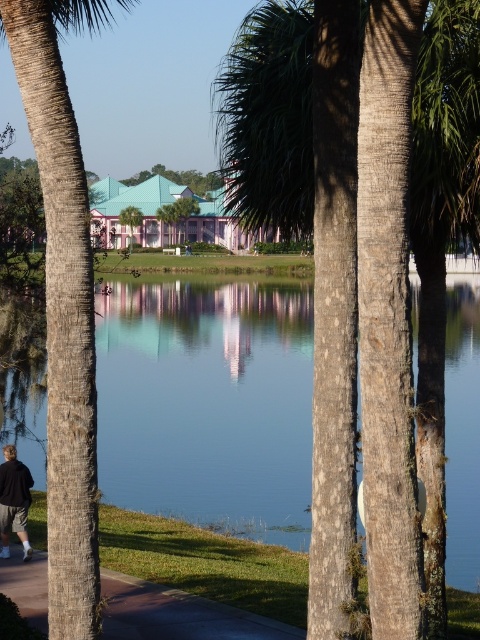
Question: Is blue glass water at center above black fabric person at lower left?

Choices:
 (A) yes
 (B) no

Answer: (A)

Question: Is brown textured palm tree at left positioned at the back of paved asphalt path at lower center?

Choices:
 (A) no
 (B) yes

Answer: (A)

Question: Is blue glass water at center bigger than brown textured palm tree at left?

Choices:
 (A) yes
 (B) no

Answer: (A)

Question: Which of the following is the closest to the observer?

Choices:
 (A) brown textured palm tree at left
 (B) blue glass water at center
 (C) paved asphalt path at lower center
 (D) black fabric person at lower left

Answer: (B)

Question: Among these points, which one is nearest to the camera?

Choices:
 (A) (16, 465)
 (B) (144, 588)
 (C) (31, 109)

Answer: (C)

Question: Which point appears closest to the camera in this image?

Choices:
 (A) (408, 444)
 (B) (220, 336)
 (C) (27, 538)

Answer: (A)